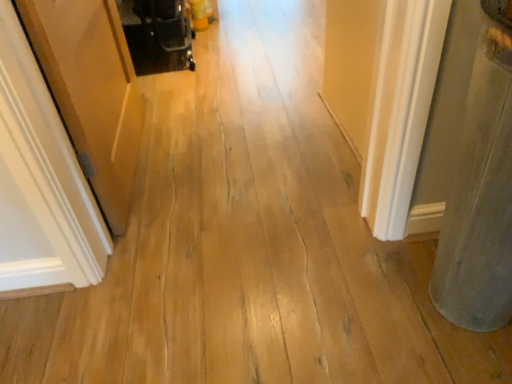
Question: In the image, is wooden door at left positioned in front of or behind black plastic baby carriage at upper left?

Choices:
 (A) behind
 (B) front

Answer: (B)

Question: From a real-world perspective, is wooden door at left above or below black plastic baby carriage at upper left?

Choices:
 (A) below
 (B) above

Answer: (B)

Question: Based on their relative distances, which object is farther from the gray felt pillow at right?

Choices:
 (A) wooden door at left
 (B) black plastic baby carriage at upper left

Answer: (B)

Question: Which object is positioned farthest from the black plastic baby carriage at upper left?

Choices:
 (A) wooden door at left
 (B) gray felt pillow at right

Answer: (B)